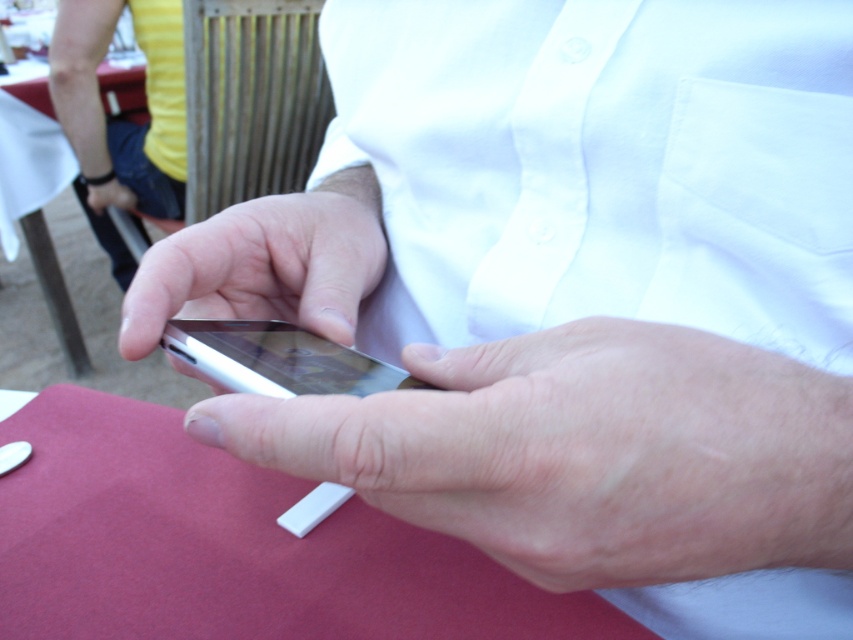
Can you confirm if smooth red cloth at lower center is positioned below matte black phone at center?

Indeed, smooth red cloth at lower center is positioned under matte black phone at center.

Between point (138, 465) and point (125, 195), which one is positioned behind?

The point (125, 195) is more distant.

Is point (183, 541) closer to camera compared to point (123, 186)?

That is True.

At what (x,y) coordinates should I click in order to perform the action: click on smooth red cloth at lower center. Please return your answer as a coordinate pair (x, y). Looking at the image, I should click on (229, 547).

Is the position of smooth red cloth at lower center more distant than that of white glossy smartphone at center?

Yes, smooth red cloth at lower center is behind white glossy smartphone at center.

Can you confirm if smooth red cloth at lower center is positioned to the left of white glossy smartphone at center?

Indeed, smooth red cloth at lower center is positioned on the left side of white glossy smartphone at center.

Does point (128, 536) lie in front of point (199, 324)?

No, it is not.

You are a GUI agent. You are given a task and a screenshot of the screen. Output one action in this format:
    pyautogui.click(x=<x>, y=<y>)
    Task: Click on the smooth red cloth at lower center
    The image size is (853, 640).
    Given the screenshot: What is the action you would take?
    point(229,547)

Which is above, silver metallic phone at center or metallic silver phone at center?

metallic silver phone at center

Is point (640, 577) positioned behind point (231, 216)?

No.

Is point (585, 426) in front of point (216, 243)?

Yes.

This screenshot has width=853, height=640. I want to click on silver metallic phone at center, so click(585, 452).